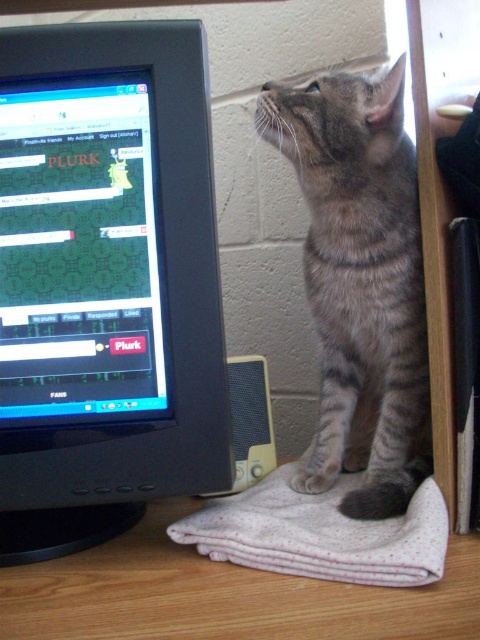
Where is the gray striped cat at upper right located in the image?

The gray striped cat at upper right is located at point [360,282] in the image.

You are setting up a desk and need to place the black plastic monitor at left and the matte black monitor at center. Which monitor has a greater width?

The black plastic monitor at left has a greater width than the matte black monitor at center according to the description.